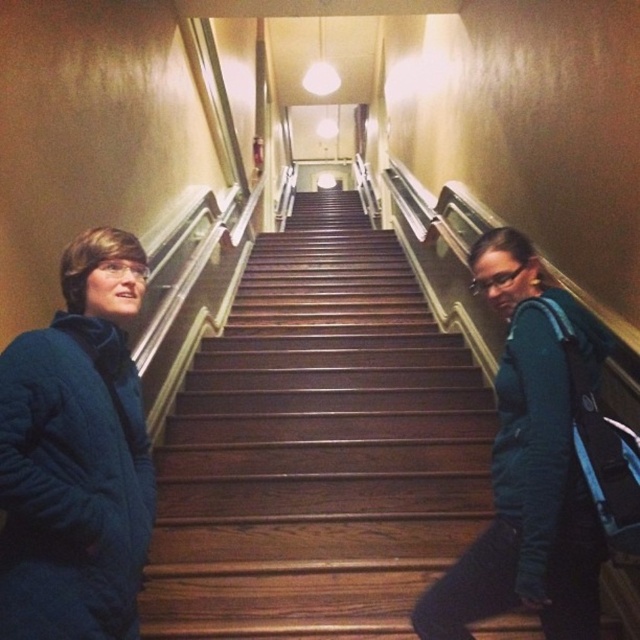
Who is taller, blue puffy jacket at left or blue fleece jacket at left?

With more height is blue fleece jacket at left.

From the picture: Who is more distant from viewer, (147, 449) or (534, 596)?

A: Point (147, 449)

This screenshot has width=640, height=640. I want to click on blue puffy jacket at left, so click(x=76, y=456).

Locate an element on the screen. brown wooden stairs at center is located at coordinates (317, 445).

Does point (321, 588) lie behind point (531, 307)?

Yes, it is.

Who is more forward, (392, 404) or (499, 387)?

Point (499, 387) is more forward.

Identify the location of brown wooden stairs at center. (317, 445).

Which of these two, brown wooden stairs at center or blue puffy jacket at left, stands shorter?

brown wooden stairs at center

Who is more distant from viewer, (284,296) or (129,240)?

Result: Positioned behind is point (284,296).

Is point (433, 525) more distant than point (83, 330)?

Yes.

You are a GUI agent. You are given a task and a screenshot of the screen. Output one action in this format:
    pyautogui.click(x=<x>, y=<y>)
    Task: Click on the brown wooden stairs at center
    This screenshot has height=640, width=640.
    Given the screenshot: What is the action you would take?
    pyautogui.click(x=317, y=445)